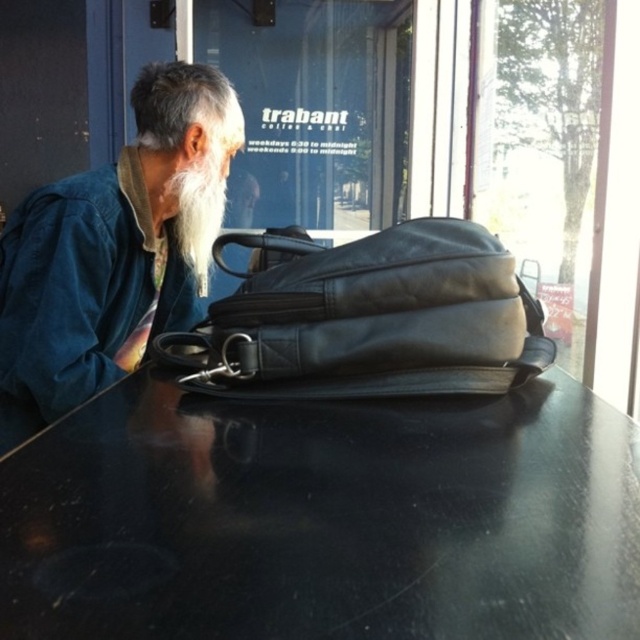
Is black glossy table at center shorter than blue denim jacket at left?

Yes, black glossy table at center is shorter than blue denim jacket at left.

Who is positioned more to the right, black glossy table at center or blue denim jacket at left?

black glossy table at center

Does point (20, 515) come farther from viewer compared to point (77, 352)?

No, (20, 515) is closer to viewer.

Identify the location of black glossy table at center. The height and width of the screenshot is (640, 640). (324, 516).

Is black leather bag at center further to camera compared to white fuzzy beard at left?

No, black leather bag at center is in front of white fuzzy beard at left.

Is point (472, 256) positioned before point (200, 268)?

Yes, point (472, 256) is closer to viewer.

What do you see at coordinates (369, 320) in the screenshot? The image size is (640, 640). I see `black leather bag at center` at bounding box center [369, 320].

Locate an element on the screen. The width and height of the screenshot is (640, 640). black leather bag at center is located at coordinates (369, 320).

Does blue denim jacket at left have a greater width compared to black leather bag at center?

No.

Measure the distance from blue denim jacket at left to black leather bag at center.

blue denim jacket at left is 46.48 centimeters away from black leather bag at center.

Does point (3, 305) come farther from viewer compared to point (310, 266)?

Yes, it is behind point (310, 266).

Find the location of a particular element. This screenshot has height=640, width=640. blue denim jacket at left is located at coordinates click(115, 250).